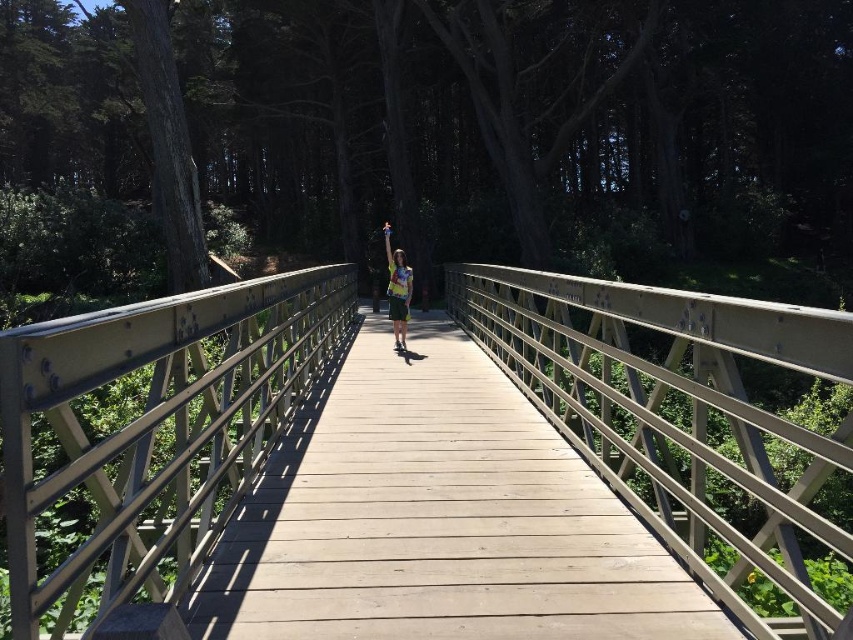
You are a parent trying to ensure your child stays safe on the wooden pedestrian bridge. The child is standing at the center of the bridge holding a small object. Based on the scene, which object between the metallic silver rail at center and the printed cotton shirt at center is shorter and requires closer attention to prevent the child from climbing over it?

The metallic silver rail at center is shorter than the printed cotton shirt at center. Since the rail is lower, it may pose a safety concern as the child could potentially climb over it. Ensure supervision to prevent the child from doing so.